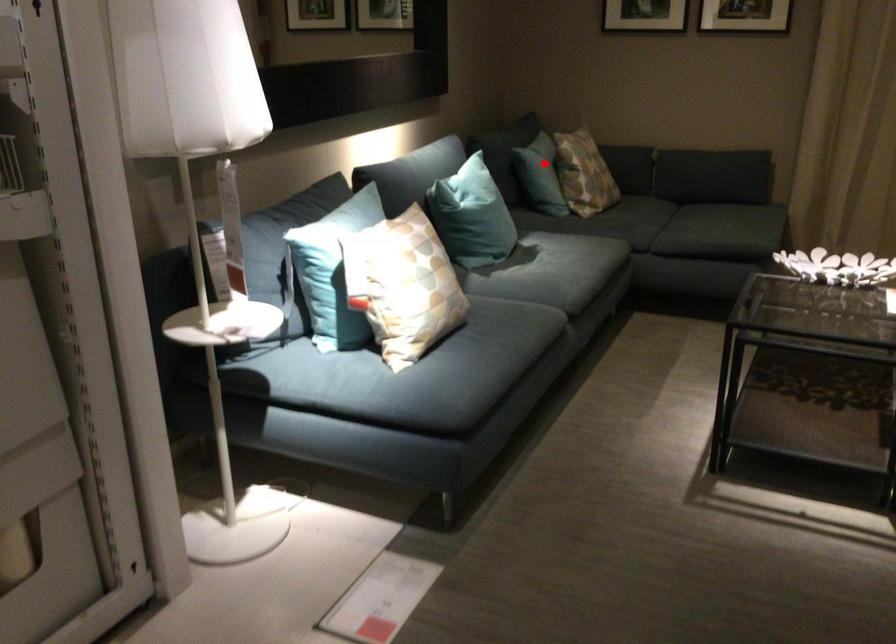
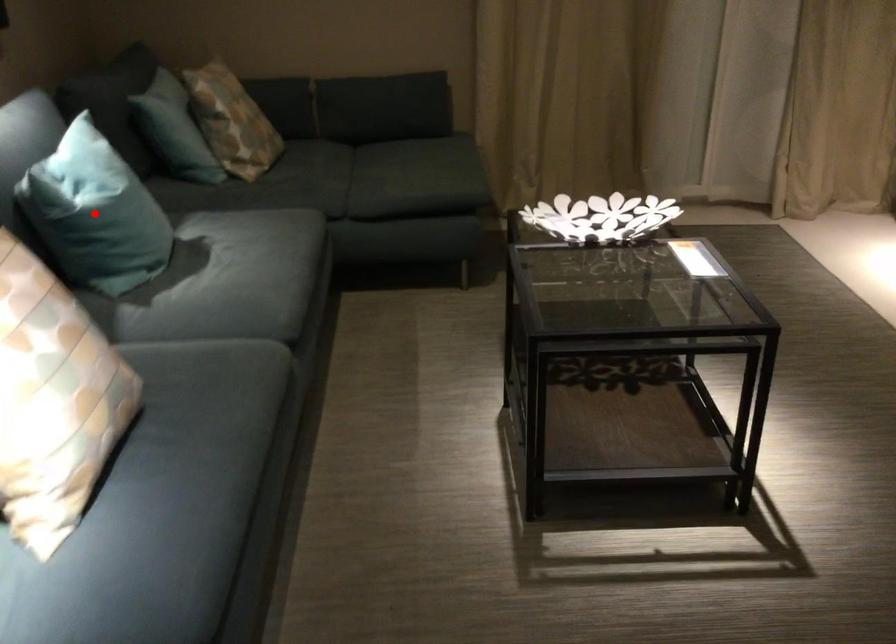
I am providing you with two images of the same scene from different viewpoints. A red point is marked on the first image and another point is marked on the second image. Do the highlighted points in image1 and image2 indicate the same real-world spot?

No